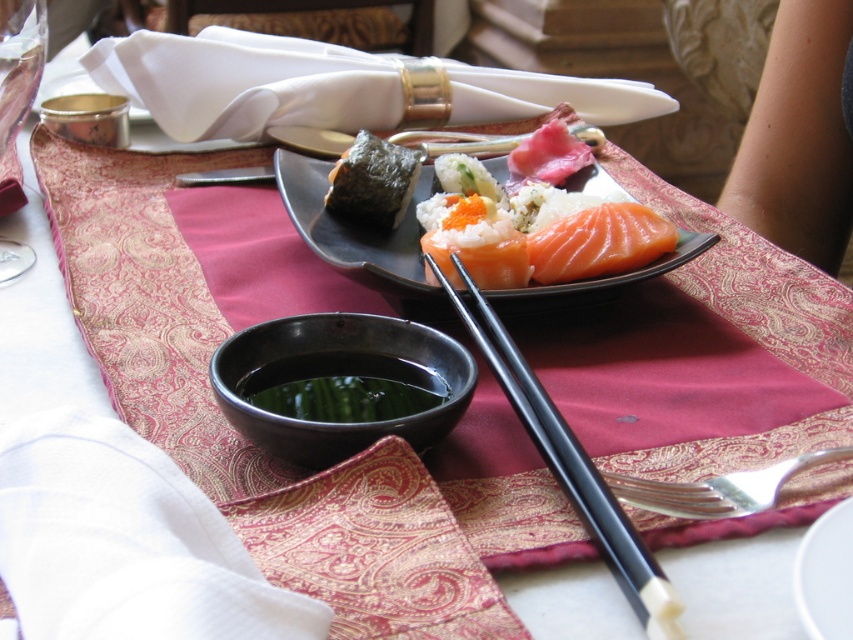
Between point (332, 259) and point (817, 589), which one is positioned in front?

Point (817, 589)

Is shiny black plate at center above white glossy plate at center?

Yes.

Is point (320, 252) farther from viewer compared to point (815, 570)?

Yes, it is.

This screenshot has height=640, width=853. In order to click on shiny black plate at center in this screenshot , I will do `click(352, 228)`.

Can you confirm if black glossy bowl at center is positioned below silver metallic fork at lower right?

Incorrect, black glossy bowl at center is not positioned below silver metallic fork at lower right.

Consider the image. Does black glossy bowl at center appear on the left side of silver metallic fork at lower right?

Indeed, black glossy bowl at center is positioned on the left side of silver metallic fork at lower right.

Is point (355, 449) positioned before point (642, 496)?

Yes, point (355, 449) is closer to viewer.

Find the location of `black glossy bowl at center`. black glossy bowl at center is located at coordinates (339, 374).

Does black glossy bowl at center have a greater height compared to shiny black plate at center?

No.

Does black glossy bowl at center lie in front of shiny black plate at center?

That is True.

The height and width of the screenshot is (640, 853). Find the location of `black glossy bowl at center`. black glossy bowl at center is located at coordinates (339, 374).